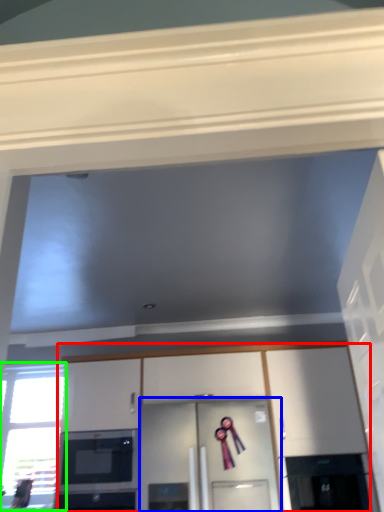
Question: Which object is the closest to the cabinetry (highlighted by a red box)? Choose among these: glass door (highlighted by a blue box) or window (highlighted by a green box).

Choices:
 (A) glass door
 (B) window

Answer: (A)